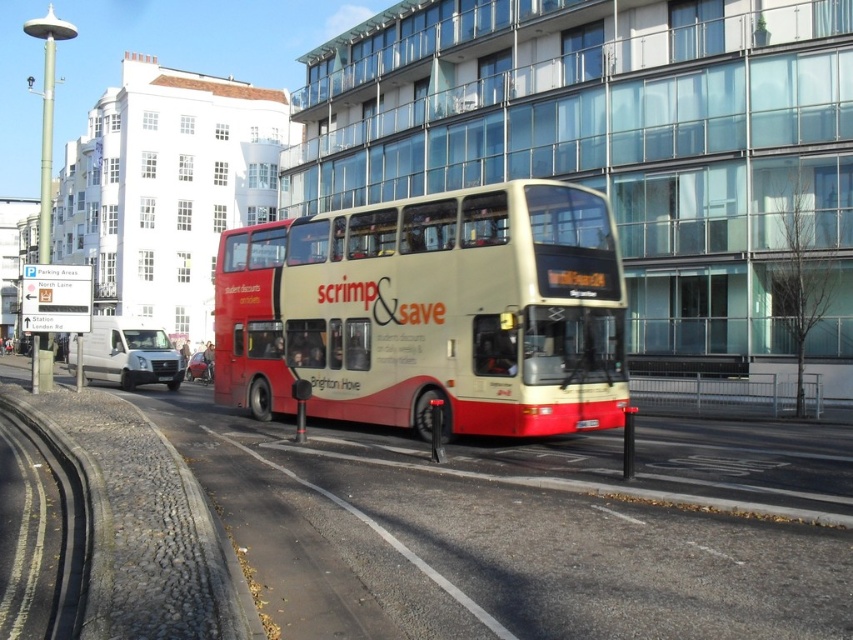
Can you confirm if matte cream double-decker bus at center is thinner than yellow matte license plate at center?

Incorrect, matte cream double-decker bus at center's width is not less than yellow matte license plate at center's.

How distant is matte cream double-decker bus at center from yellow matte license plate at center?

matte cream double-decker bus at center is 4.20 meters away from yellow matte license plate at center.

What do you see at coordinates (430, 312) in the screenshot? This screenshot has height=640, width=853. I see `matte cream double-decker bus at center` at bounding box center [430, 312].

You are a GUI agent. You are given a task and a screenshot of the screen. Output one action in this format:
    pyautogui.click(x=<x>, y=<y>)
    Task: Click on the matte cream double-decker bus at center
    The height and width of the screenshot is (640, 853).
    Given the screenshot: What is the action you would take?
    pyautogui.click(x=430, y=312)